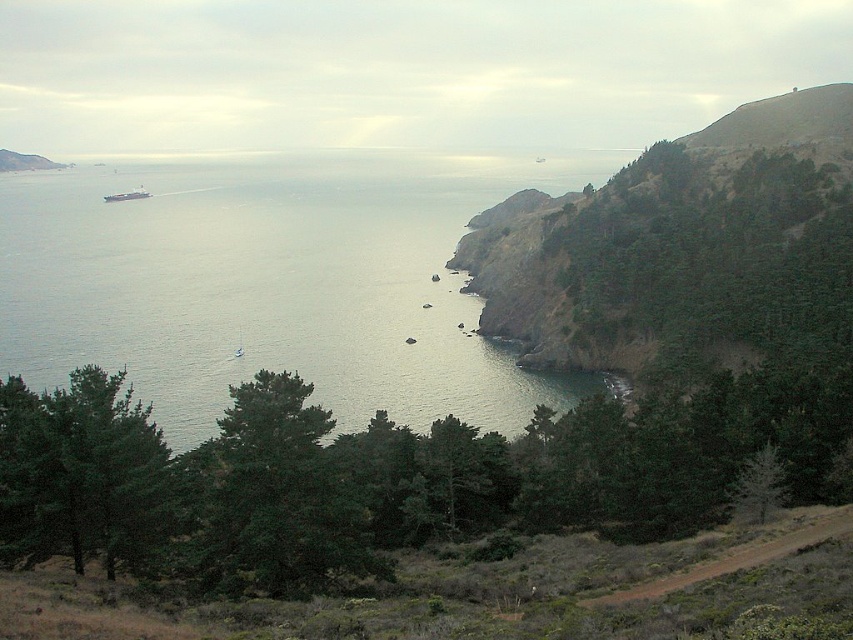
Can you confirm if brown dirt path at lower right is shorter than metallic gray ship at left?

Yes.

Does brown dirt path at lower right appear on the right side of metallic gray ship at left?

Indeed, brown dirt path at lower right is positioned on the right side of metallic gray ship at left.

Is point (808, 532) more distant than point (135, 196)?

That is False.

Identify the location of brown dirt path at lower right. This screenshot has height=640, width=853. (735, 557).

Which of these two, green matte tree at center or metallic gray ship at left, stands shorter?

With less height is green matte tree at center.

Measure the distance from green matte tree at center to metallic gray ship at left.

green matte tree at center is 469.26 meters from metallic gray ship at left.

Which is in front, point (369, 552) or point (125, 192)?

Point (369, 552) is more forward.

Identify the location of green matte tree at center. (274, 499).

Which is above, green matte tree at lower left or green grassy hillside at left?

Positioned higher is green grassy hillside at left.

Between green matte tree at lower left and green grassy hillside at left, which one has more height?

green grassy hillside at left

Locate an element on the screen. This screenshot has width=853, height=640. green matte tree at lower left is located at coordinates (80, 474).

Locate an element on the screen. green matte tree at lower left is located at coordinates (80, 474).